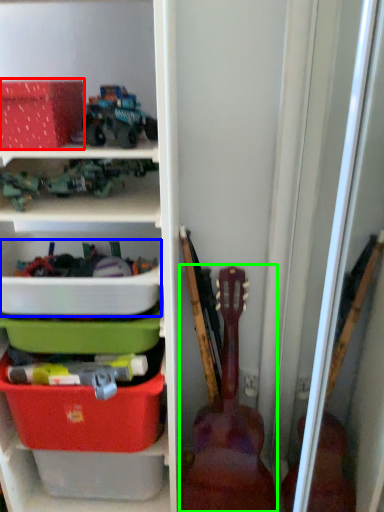
Question: Which object is positioned closest to storage box (highlighted by a red box)? Select from storage box (highlighted by a blue box) and guitar (highlighted by a green box).

Choices:
 (A) storage box
 (B) guitar

Answer: (A)